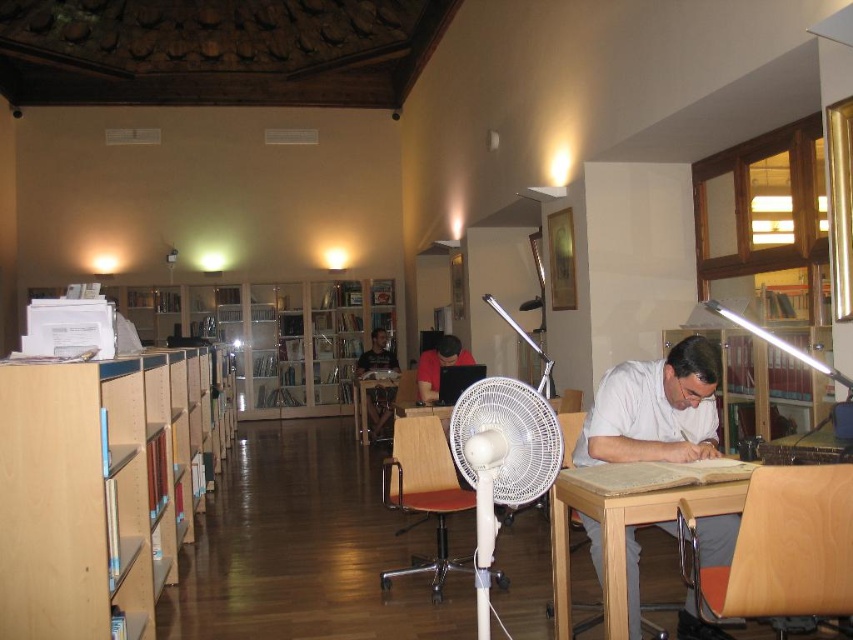
You are standing in the library and notice a white plastic fan at center and a red matte shirt at center. Which object is located below the other?

The white plastic fan at center is positioned under the red matte shirt at center.

You are standing in the library and notice a wooden bookcase at center and a dark blue shirt at center. Which object is wider?

The wooden bookcase at center is wider than the dark blue shirt at center.

You are standing in the library and want to move from point A to point B. Point A is at coordinate point (274, 417) and point B is at coordinate point (386, 394). Since you can only move forward, will you be able to reach point B from point A without turning?

Point A is further to the viewer than point B, so you can move forward from point A to point B without needing to turn.